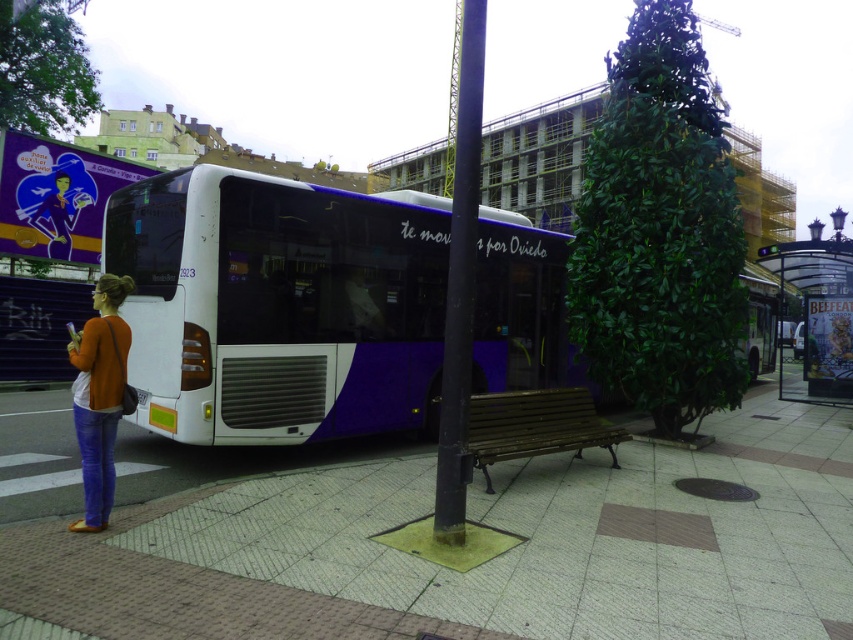
Question: Estimate the real-world distances between objects in this image. Which object is closer to the orange sweater at left?

Choices:
 (A) wooden bench at center
 (B) transparent plastic bus stop at right
 (C) smooth concrete bench at center

Answer: (C)

Question: Does smooth concrete bench at center have a lesser width compared to orange sweater at left?

Choices:
 (A) no
 (B) yes

Answer: (A)

Question: Is the position of smooth concrete bench at center less distant than that of orange sweater at left?

Choices:
 (A) no
 (B) yes

Answer: (B)

Question: Is white matte bus at center to the right of orange sweater at left from the viewer's perspective?

Choices:
 (A) yes
 (B) no

Answer: (A)

Question: Which of the following is the closest to the observer?

Choices:
 (A) (486, 488)
 (B) (108, 472)
 (C) (532, 556)
 (D) (840, 256)

Answer: (C)

Question: Which of the following is the closest to the observer?

Choices:
 (A) orange sweater at left
 (B) white matte bus at center
 (C) wooden bench at center

Answer: (A)